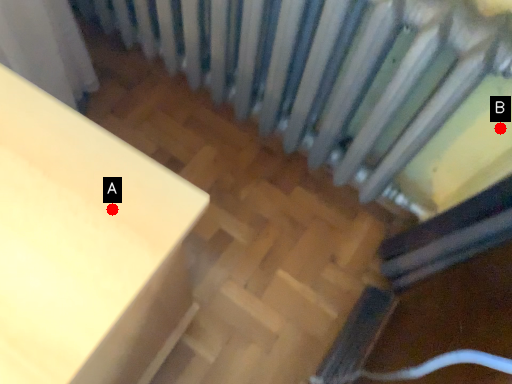
Question: Two points are circled on the image, labeled by A and B beside each circle. Which of the following is the farthest from the observer?

Choices:
 (A) A is further
 (B) B is further

Answer: (B)